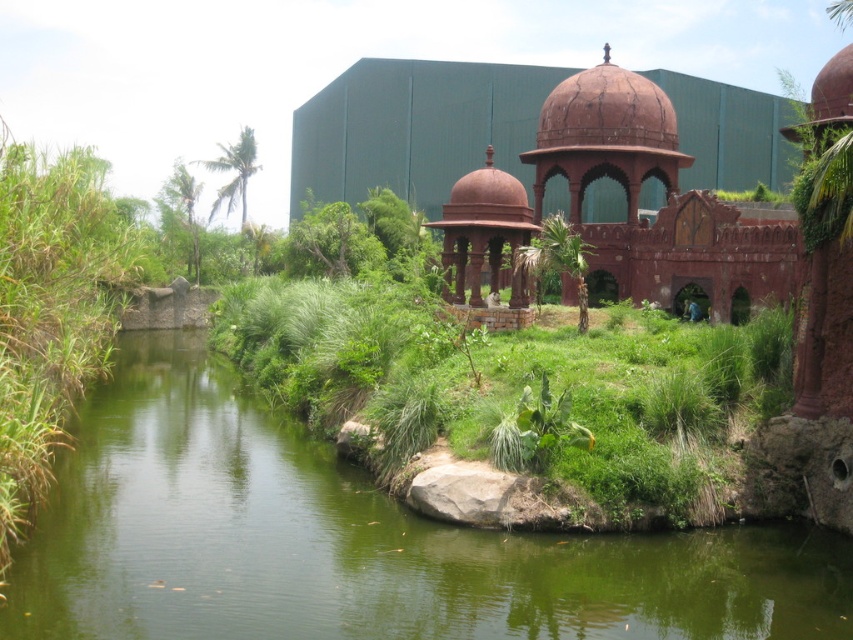
You are planning to cross the green grassy stream at center to reach the rustic stone gazebo at center. Given that the stream is 2 meters wide, can you safely cross it without getting wet?

The green grassy stream at center and rustic stone gazebo at center are 19.36 meters apart from each other. Since the stream is only 2 meters wide, you can safely cross it without getting wet by stepping over it to reach the gazebo.

You are planning to build a small wooden bridge that is 1.2 meters tall. You want to place it over the green grassy stream at center and rustic stone gazebo at center. Which object will the bridge be taller than?

The green grassy stream at center is not as tall as rustic stone gazebo at center. Since the bridge is 1.2 meters tall, it will be taller than the green grassy stream at center but shorter than the rustic stone gazebo at center.